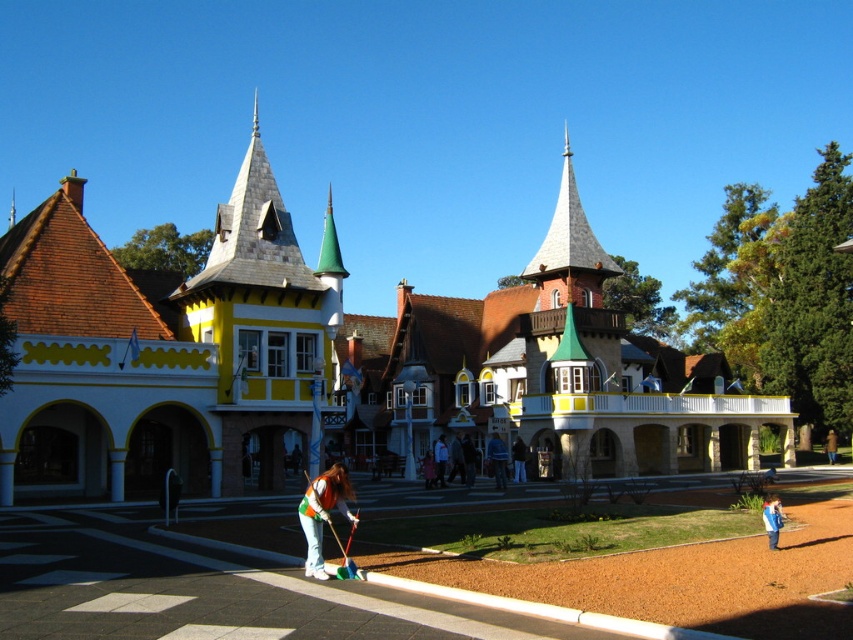
Who is higher up, green fabric shirt at center or blue fabric jacket at lower right?

green fabric shirt at center

Where is `green fabric shirt at center`? The height and width of the screenshot is (640, 853). green fabric shirt at center is located at coordinates (322, 513).

The image size is (853, 640). Describe the element at coordinates (322, 513) in the screenshot. I see `green fabric shirt at center` at that location.

What are the coordinates of `green fabric shirt at center` in the screenshot? It's located at (322, 513).

Is green fabric jacket at center closer to camera compared to blue fabric jacket at lower right?

No, it is behind blue fabric jacket at lower right.

Can you confirm if green fabric jacket at center is bigger than blue fabric jacket at lower right?

No.

Identify the location of green fabric jacket at center. The image size is (853, 640). (497, 460).

Identify the location of green fabric jacket at center. (497, 460).

Can you confirm if green fabric shirt at center is shorter than green fabric jacket at center?

Incorrect, green fabric shirt at center's height does not fall short of green fabric jacket at center's.

Is green fabric shirt at center in front of green fabric jacket at center?

Yes, green fabric shirt at center is closer to the viewer.

Where is `green fabric shirt at center`? green fabric shirt at center is located at coordinates (322, 513).